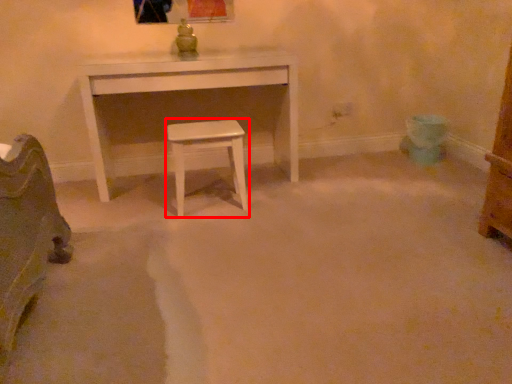
Question: From the image's perspective, what is the correct spatial positioning of stool (annotated by the red box) in reference to table?

Choices:
 (A) above
 (B) below

Answer: (B)